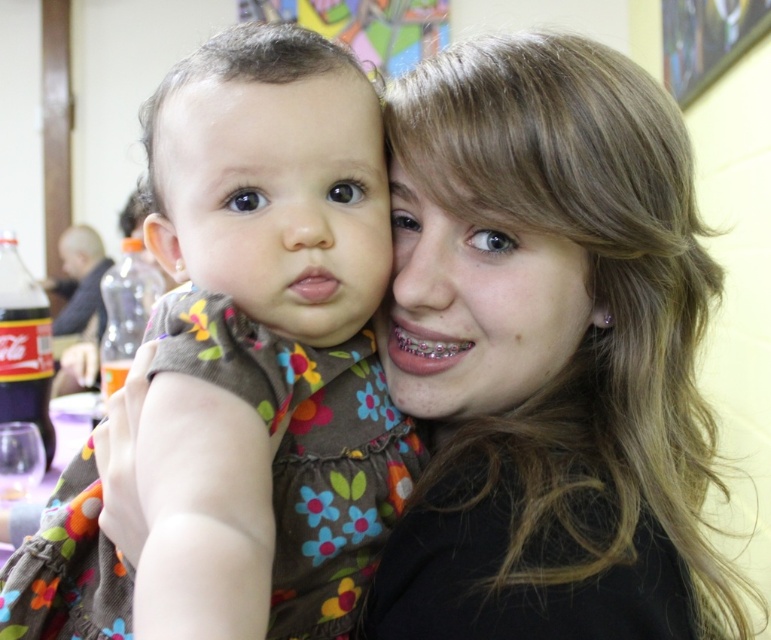
Can you confirm if smooth blonde hair at center is positioned above floral fabric dress at center?

Indeed, smooth blonde hair at center is positioned over floral fabric dress at center.

Is point (396, 84) positioned before point (258, 243)?

No, it is behind (258, 243).

In order to click on smooth blonde hair at center in this screenshot , I will do `click(547, 353)`.

In the scene shown: Between brown matte baby at center and matte plastic bottle at left, which one has more height?

With more height is matte plastic bottle at left.

Can you confirm if brown matte baby at center is wider than matte plastic bottle at left?

No.

Is point (243, 163) positioned in front of point (150, 285)?

Yes, it is.

Where is `brown matte baby at center`? This screenshot has width=771, height=640. brown matte baby at center is located at coordinates (278, 198).

Who is positioned more to the left, smooth blonde hair at center or matte plastic bottle at left?

matte plastic bottle at left is more to the left.

Does point (699, 412) come behind point (123, 340)?

No, it is in front of (123, 340).

Where is `smooth blonde hair at center`? The width and height of the screenshot is (771, 640). smooth blonde hair at center is located at coordinates (547, 353).